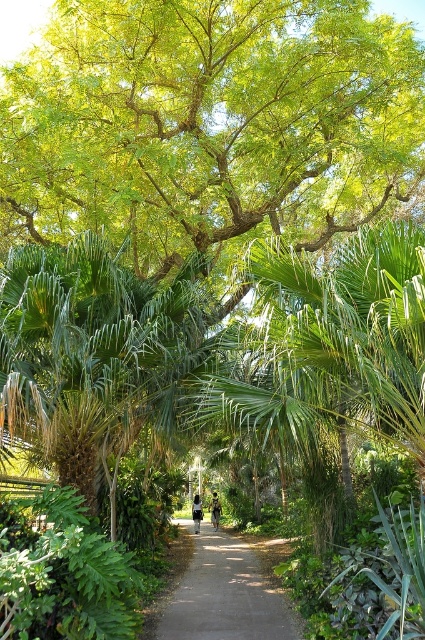
Question: Which is farther from the green leafy palm tree at center?

Choices:
 (A) dirt/gravel path at center
 (B) green leafy tree at upper center

Answer: (A)

Question: Does green leafy palm tree at center come behind dirt/gravel path at center?

Choices:
 (A) no
 (B) yes

Answer: (A)

Question: Can you confirm if green leafy palm tree at center is wider than dirt/gravel path at center?

Choices:
 (A) yes
 (B) no

Answer: (A)

Question: Among these points, which one is nearest to the camera?

Choices:
 (A) (82, 301)
 (B) (59, 0)

Answer: (A)

Question: Considering the relative positions of green leafy tree at upper center and green leafy palm tree at center in the image provided, where is green leafy tree at upper center located with respect to green leafy palm tree at center?

Choices:
 (A) above
 (B) below

Answer: (A)

Question: Estimate the real-world distances between objects in this image. Which object is farther from the green leafy palm tree at center?

Choices:
 (A) green leafy tree at upper center
 (B) dirt/gravel path at center

Answer: (B)